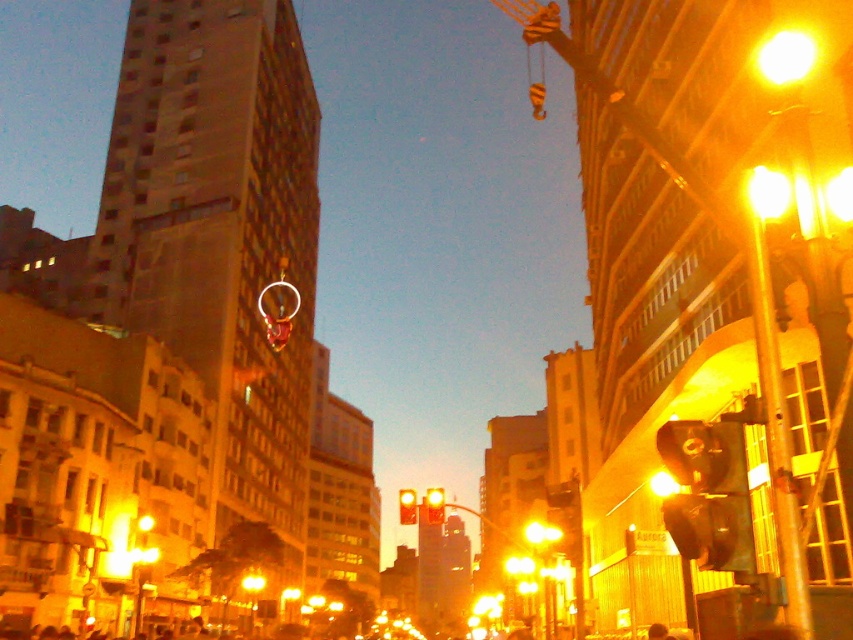
Is matte black traffic light at right to the left of yellow glass traffic light at center from the viewer's perspective?

Incorrect, matte black traffic light at right is not on the left side of yellow glass traffic light at center.

Is matte black traffic light at right wider than yellow glass traffic light at center?

Correct, the width of matte black traffic light at right exceeds that of yellow glass traffic light at center.

Where is `matte black traffic light at right`? The height and width of the screenshot is (640, 853). matte black traffic light at right is located at coordinates (708, 493).

This screenshot has width=853, height=640. What are the coordinates of `matte black traffic light at right` in the screenshot? It's located at (708, 493).

Which is above, yellow glass traffic light at center or yellow matte traffic light at center?

yellow glass traffic light at center

Is point (427, 502) positioned before point (412, 518)?

No, it is behind (412, 518).

Where is `yellow glass traffic light at center`? This screenshot has height=640, width=853. yellow glass traffic light at center is located at coordinates (434, 506).

I want to click on yellow glass traffic light at center, so click(x=434, y=506).

Can you confirm if matte black traffic light at right is positioned below yellow matte traffic light at center?

No.

Which is in front, point (689, 420) or point (399, 524)?

Point (689, 420)

Which is behind, point (741, 561) or point (407, 499)?

The point (407, 499) is behind.

Find the location of a particular element. matte black traffic light at right is located at coordinates (708, 493).